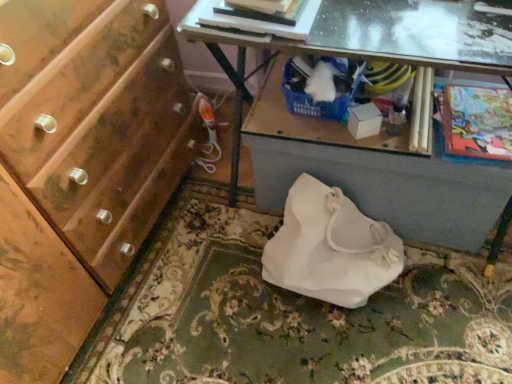
Locate an element on the screen. The image size is (512, 384). blank space situated above cartoon paper comic book at right (from a real-world perspective) is located at coordinates (477, 115).